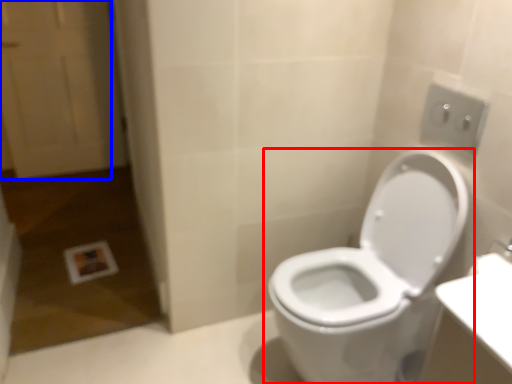
Question: Which of the following is the farthest to the observer, toilet (highlighted by a red box) or screen door (highlighted by a blue box)?

Choices:
 (A) toilet
 (B) screen door

Answer: (B)